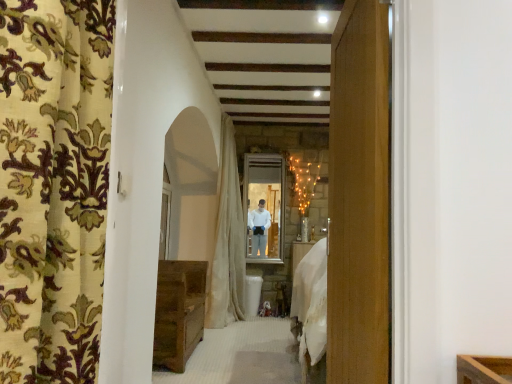
Question: Considering the relative sizes of white textured curtain at center, placed as the 1th curtain when sorted from back to front, and clear glass window at center, which ranks as the 1th window in back-to-front order, in the image provided, is white textured curtain at center, placed as the 1th curtain when sorted from back to front, bigger than clear glass window at center, which ranks as the 1th window in back-to-front order,?

Choices:
 (A) no
 (B) yes

Answer: (B)

Question: Is white textured curtain at center, placed as the 1th curtain when sorted from back to front, further to the viewer compared to clear glass window at center, which ranks as the 1th window in back-to-front order?

Choices:
 (A) yes
 (B) no

Answer: (B)

Question: From the image's perspective, is white textured curtain at center, placed as the 1th curtain when sorted from back to front, over clear glass window at center, which ranks as the second window in left-to-right order?

Choices:
 (A) yes
 (B) no

Answer: (B)

Question: Would you say white textured curtain at center, placed as the 1th curtain when sorted from back to front, is outside clear glass window at center, which ranks as the 1th window in back-to-front order?

Choices:
 (A) no
 (B) yes

Answer: (B)

Question: Can you confirm if white textured curtain at center, which is counted as the second curtain, starting from the front, is wider than clear glass window at center, marked as the 1th window in a right-to-left arrangement?

Choices:
 (A) yes
 (B) no

Answer: (A)

Question: Choose the correct answer: Is floral fabric curtain at left, the 1th curtain positioned from the front, inside clear glass window at center, positioned as the 2th window in right-to-left order, or outside it?

Choices:
 (A) outside
 (B) inside

Answer: (A)

Question: Is point (61, 360) closer or farther from the camera than point (165, 170)?

Choices:
 (A) farther
 (B) closer

Answer: (B)

Question: From the image's perspective, relative to clear glass window at center, positioned as the 2th window in right-to-left order, is floral fabric curtain at left, the 2th curtain positioned from the back, above or below?

Choices:
 (A) below
 (B) above

Answer: (B)

Question: Relative to clear glass window at center, positioned as the 2th window in right-to-left order, is floral fabric curtain at left, the 1th curtain positioned from the front, in front or behind?

Choices:
 (A) front
 (B) behind

Answer: (A)

Question: Is clear glass window at center, which appears as the second window when viewed from the back, in front of or behind white textured curtain at center, which is counted as the second curtain, starting from the front, in the image?

Choices:
 (A) behind
 (B) front

Answer: (B)

Question: Looking at the image, does clear glass window at center, positioned as the 2th window in right-to-left order, seem bigger or smaller compared to white textured curtain at center, which is counted as the second curtain, starting from the front?

Choices:
 (A) small
 (B) big

Answer: (A)

Question: Do you think clear glass window at center, which appears as the second window when viewed from the back, is within white textured curtain at center, which is counted as the second curtain, starting from the front, or outside of it?

Choices:
 (A) outside
 (B) inside

Answer: (A)

Question: Considering the positions of clear glass window at center, marked as the 1th window in a front-to-back arrangement, and white textured curtain at center, which is counted as the second curtain, starting from the front, in the image, is clear glass window at center, marked as the 1th window in a front-to-back arrangement, wider or thinner than white textured curtain at center, which is counted as the second curtain, starting from the front,?

Choices:
 (A) wide
 (B) thin

Answer: (B)

Question: Is clear glass window at center, marked as the 1th window in a right-to-left arrangement, wider or thinner than white textured curtain at center, which is counted as the second curtain, starting from the front?

Choices:
 (A) wide
 (B) thin

Answer: (B)

Question: Looking at the image, does clear glass window at center, marked as the 1th window in a right-to-left arrangement, seem bigger or smaller compared to white textured curtain at center, which is counted as the second curtain, starting from the front?

Choices:
 (A) big
 (B) small

Answer: (B)